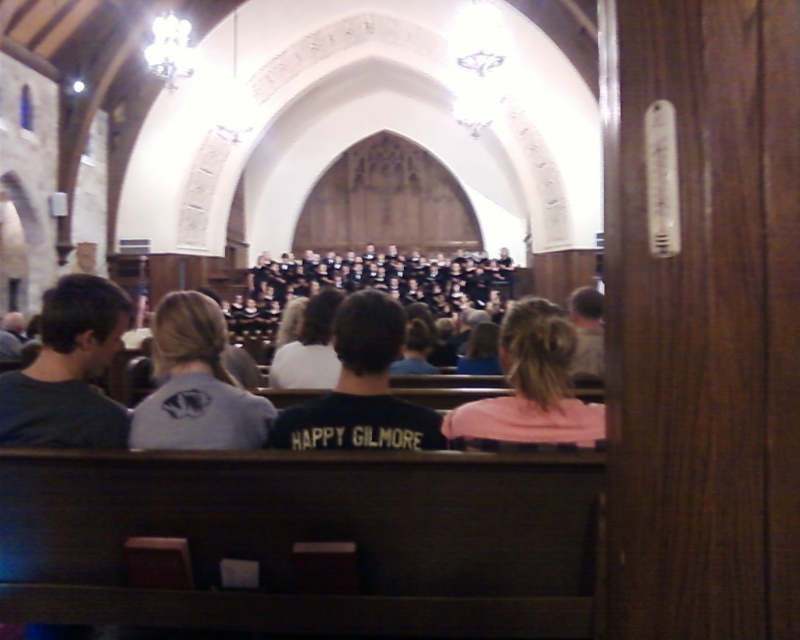
Does dark gray t-shirt at left appear on the left side of pink fabric hair at center?

Yes, dark gray t-shirt at left is to the left of pink fabric hair at center.

Which of these two, dark gray t-shirt at left or pink fabric hair at center, stands shorter?

With less height is pink fabric hair at center.

Identify the location of dark gray t-shirt at left. The width and height of the screenshot is (800, 640). (68, 371).

Which of these two, black matte shirt at center or pink fabric hair at center, stands shorter?

With less height is black matte shirt at center.

Does point (322, 420) lie behind point (525, 305)?

No, (322, 420) is closer to viewer.

The height and width of the screenshot is (640, 800). What do you see at coordinates (360, 388) in the screenshot?
I see `black matte shirt at center` at bounding box center [360, 388].

You are a GUI agent. You are given a task and a screenshot of the screen. Output one action in this format:
    pyautogui.click(x=<x>, y=<y>)
    Task: Click on the black matte shirt at center
    
    Given the screenshot: What is the action you would take?
    pyautogui.click(x=360, y=388)

Image resolution: width=800 pixels, height=640 pixels. What are the coordinates of `dark gray sweater at center` in the screenshot? It's located at (196, 385).

Does dark gray sweater at center have a lesser height compared to pink fabric hair at center?

Incorrect, dark gray sweater at center's height does not fall short of pink fabric hair at center's.

Between point (214, 426) and point (480, 410), which one is positioned in front?

Positioned in front is point (214, 426).

You are a GUI agent. You are given a task and a screenshot of the screen. Output one action in this format:
    pyautogui.click(x=<x>, y=<y>)
    Task: Click on the dark gray sweater at center
    
    Given the screenshot: What is the action you would take?
    pyautogui.click(x=196, y=385)